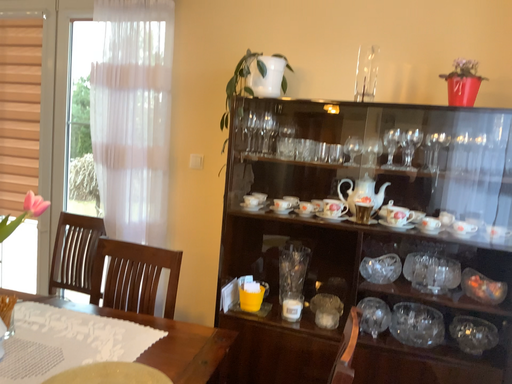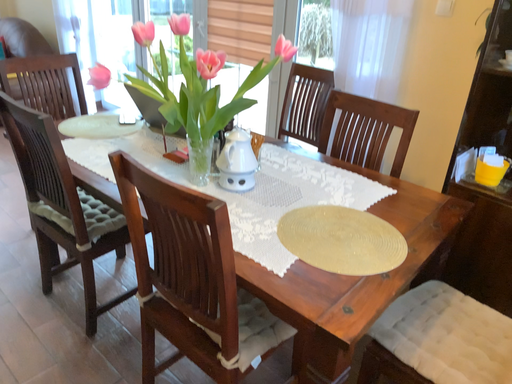
Question: How did the camera likely rotate when shooting the video?

Choices:
 (A) rotated right
 (B) rotated left

Answer: (B)